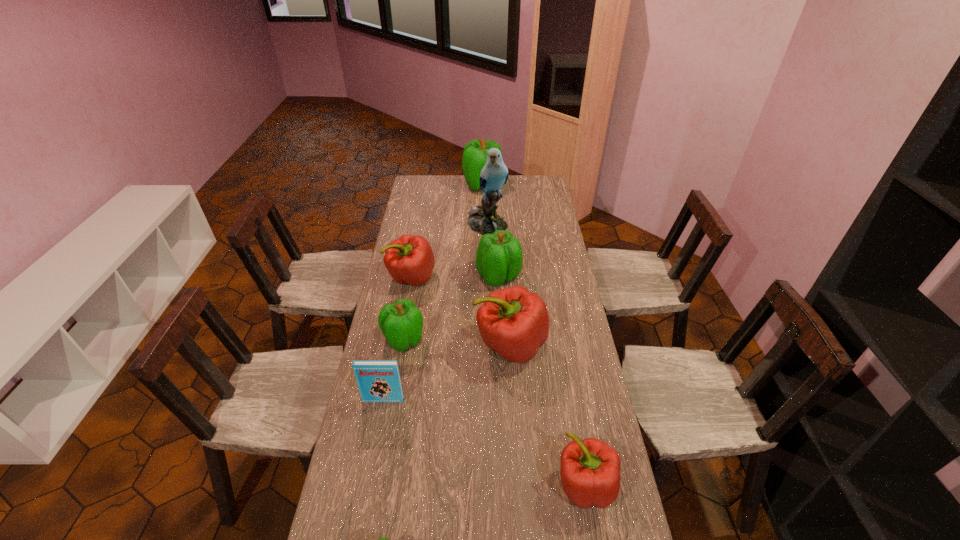
At what (x,y) coordinates should I click in order to perform the action: click on the third farthest green bell pepper. Please return your answer as a coordinate pair (x, y). Looking at the image, I should click on (401, 323).

Where is `the sixth farthest bell pepper`? The height and width of the screenshot is (540, 960). the sixth farthest bell pepper is located at coordinates (590, 469).

Find the location of a particular element. the second nearest object is located at coordinates (590, 469).

The width and height of the screenshot is (960, 540). Find the location of `vacant space located on the face of the parakeet`. vacant space located on the face of the parakeet is located at coordinates coord(489,296).

At what (x,y) coordinates should I click in order to perform the action: click on vacant space located 0.280m on the front of the biggest green bell pepper. Please return your answer as a coordinate pair (x, y). The width and height of the screenshot is (960, 540). Looking at the image, I should click on coord(483,224).

Find the location of a particular element. This screenshot has height=540, width=960. vacant space located 0.090m on the back of the biggest pink bell pepper is located at coordinates (507, 304).

The height and width of the screenshot is (540, 960). What are the coordinates of `vacant space located 0.130m on the left of the third nearest green bell pepper` in the screenshot? It's located at (445, 276).

Locate an element on the screen. blank area located on the right of the leftmost pink bell pepper is located at coordinates (468, 278).

Find the location of `free space located on the front cover of the third nearest object`. free space located on the front cover of the third nearest object is located at coordinates (372, 459).

Where is `free location located on the back of the third farthest green bell pepper`? Image resolution: width=960 pixels, height=540 pixels. free location located on the back of the third farthest green bell pepper is located at coordinates (413, 284).